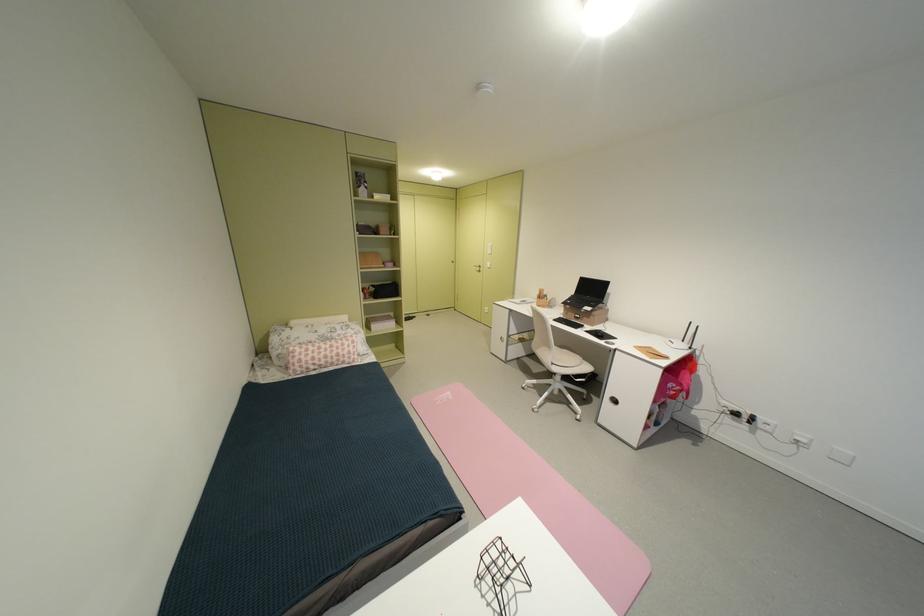
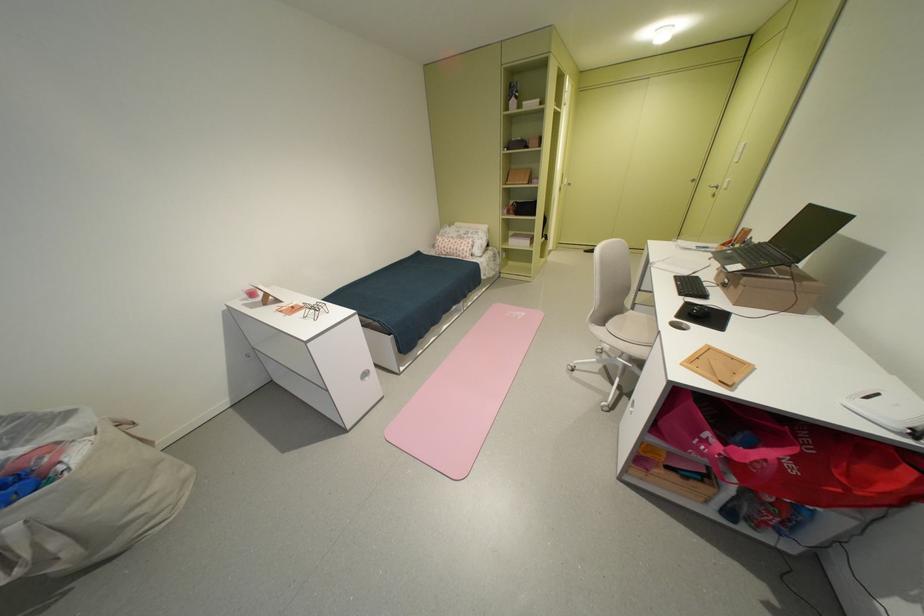
The point at (488, 269) is marked in the first image. Where is the corresponding point in the second image?

(724, 190)